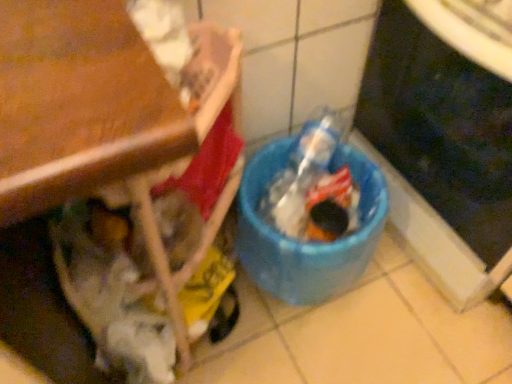
Question: Is blue plastic bucket at lower center wider or thinner than blue plastic trash can at lower right?

Choices:
 (A) thin
 (B) wide

Answer: (A)

Question: From the image's perspective, is blue plastic bucket at lower center above or below blue plastic trash can at lower right?

Choices:
 (A) below
 (B) above

Answer: (A)

Question: Choose the correct answer: Is blue plastic bucket at lower center inside blue plastic trash can at lower right or outside it?

Choices:
 (A) outside
 (B) inside

Answer: (A)

Question: In the image, is blue plastic trash can at lower right positioned in front of or behind blue plastic bucket at lower center?

Choices:
 (A) behind
 (B) front

Answer: (B)

Question: Considering the positions of blue plastic trash can at lower right and blue plastic bucket at lower center in the image, is blue plastic trash can at lower right bigger or smaller than blue plastic bucket at lower center?

Choices:
 (A) small
 (B) big

Answer: (B)

Question: Based on their positions, is blue plastic trash can at lower right located to the left or right of blue plastic bucket at lower center?

Choices:
 (A) right
 (B) left

Answer: (A)

Question: In terms of width, does blue plastic trash can at lower right look wider or thinner when compared to blue plastic bucket at lower center?

Choices:
 (A) wide
 (B) thin

Answer: (A)